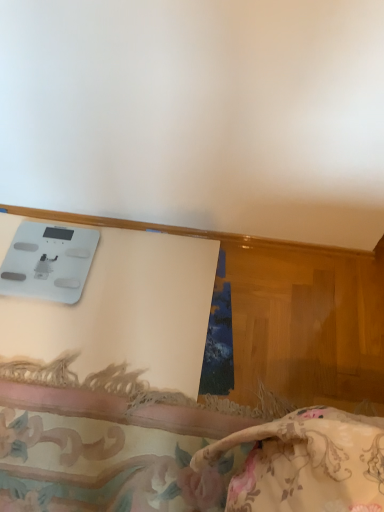
Question: Relative to white wood trim at upper center, is white glossy scale at upper left in front or behind?

Choices:
 (A) behind
 (B) front

Answer: (B)

Question: Is white glossy scale at upper left wider or thinner than white wood trim at upper center?

Choices:
 (A) thin
 (B) wide

Answer: (B)

Question: Which is nearer to the floral fabric cushion at lower center?

Choices:
 (A) white glossy scale at upper left
 (B) white wood trim at upper center

Answer: (A)

Question: Considering the real-world distances, which object is farthest from the floral fabric cushion at lower center?

Choices:
 (A) white wood trim at upper center
 (B) white glossy scale at upper left

Answer: (A)